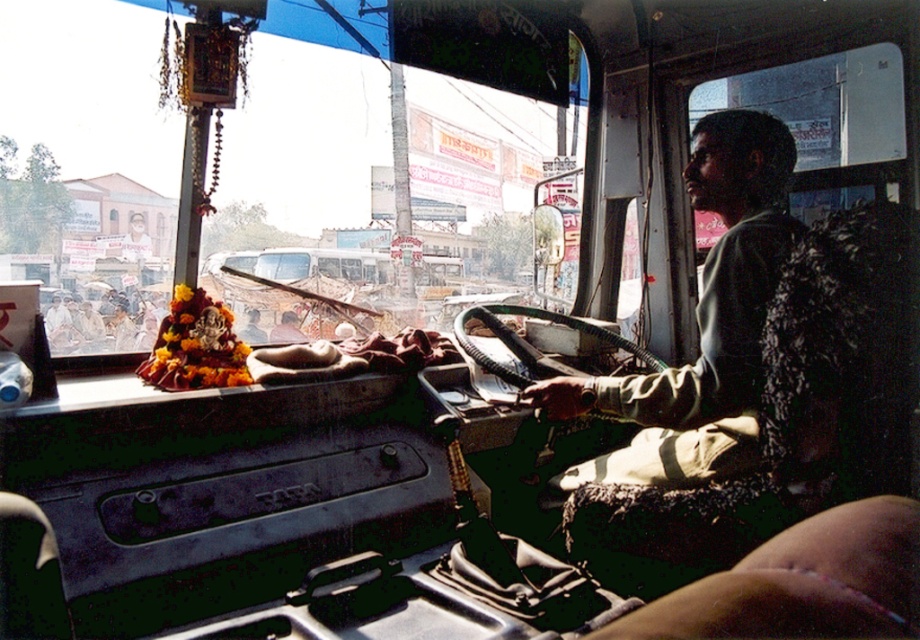
Is transparent glass windshield at upper center thinner than smooth skin at lower right?

No, transparent glass windshield at upper center is not thinner than smooth skin at lower right.

Can you confirm if transparent glass windshield at upper center is taller than smooth skin at lower right?

Yes, transparent glass windshield at upper center is taller than smooth skin at lower right.

Locate an element on the screen. The image size is (920, 640). transparent glass windshield at upper center is located at coordinates (269, 147).